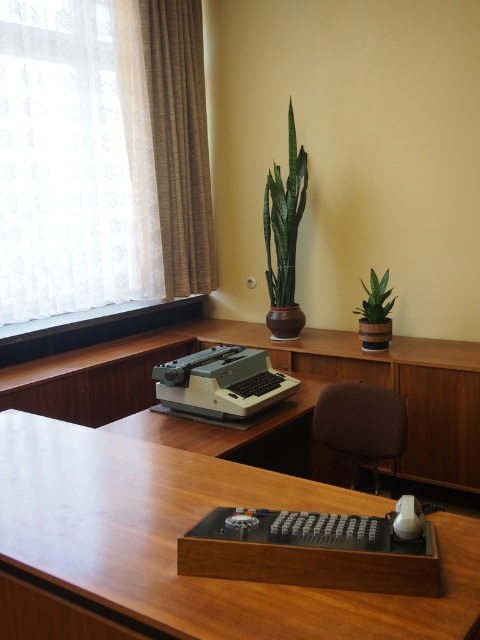
You are an office worker who needs to reach both the beige fabric curtain at upper left and the green glossy plant at upper center. The space between them is 27.93 inches. If your arm can extend 25 inches, can you reach both items without moving your body?

The distance between the beige fabric curtain at upper left and the green glossy plant at upper center is 27.93 inches. Since your arm can only extend 25 inches, you cannot reach both items simultaneously without moving your body.

You are an interior designer planning to add a new painting to the office. The painting is 1 meter wide and needs to be placed between the beige fabric curtain at upper left and the green glossy plant at upper center. Can the space between them accommodate the painting?

The beige fabric curtain at upper left is located above the green glossy plant at upper center, so there is no horizontal space between them to place the painting. The painting cannot be placed between them.

You are an office assistant who needs to place a new 10cm tall document holder on the desk. Considering the space between the matte plastic typewriter at center and the green matte plant at upper right, will the document holder fit without blocking the typewriter?

The matte plastic typewriter at center is taller than the green matte plant at upper right. Since the document holder is only 10cm tall, it should fit between them without blocking the typewriter as long as there is enough horizontal space.